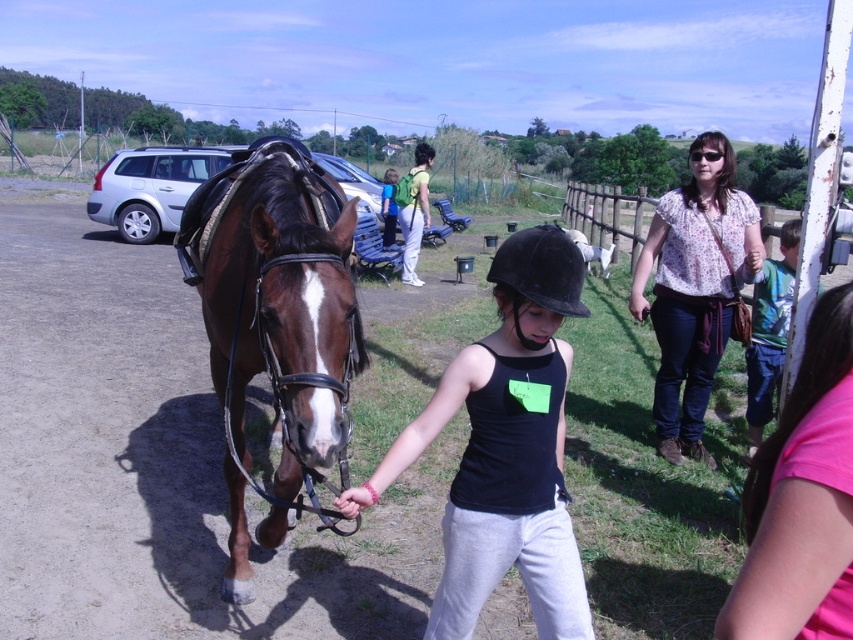
Question: Does black matte helmet at center appear on the left side of floral blouse at center?

Choices:
 (A) yes
 (B) no

Answer: (A)

Question: Is brown glossy horse at center above floral blouse at center?

Choices:
 (A) yes
 (B) no

Answer: (B)

Question: Which of the following is the farthest from the observer?

Choices:
 (A) (525, 298)
 (B) (347, 339)

Answer: (B)

Question: Which point is closer to the camera?

Choices:
 (A) (283, 214)
 (B) (553, 368)

Answer: (B)

Question: Considering the real-world distances, which object is closest to the black matte helmet at center?

Choices:
 (A) floral blouse at center
 (B) brown glossy horse at center

Answer: (B)

Question: Is brown glossy horse at center positioned before floral blouse at center?

Choices:
 (A) no
 (B) yes

Answer: (B)